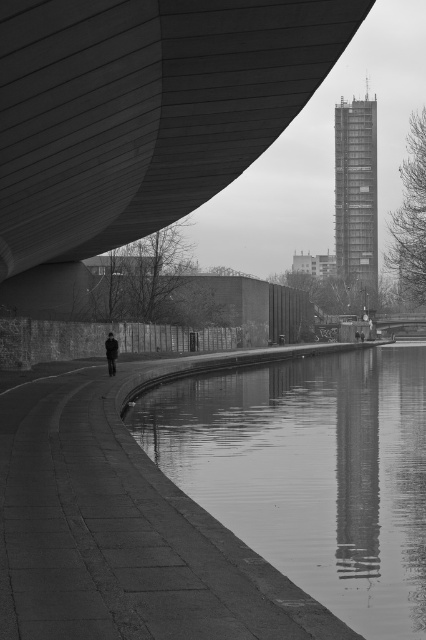
You are standing at the center of the image and want to locate the smooth concrete bridge at upper left. According to the coordinates provided, in which direction should you look to find it?

The smooth concrete bridge at upper left is located at coordinates point (143, 109), which is to the upper left direction from the center of the image.

You are a photographer standing on the smooth concrete bridge at upper left and want to take a photo of the dark gray fabric jacket at lower center. Considering the size difference between them, how might this affect your composition?

The smooth concrete bridge at upper left is larger in size than the dark gray fabric jacket at lower center, so to balance the composition, you could position the jacket centrally or use framing techniques to draw attention to it while incorporating the bridge as a backdrop.

You are standing at the curved concrete pathway in the foreground. Which direction should you walk to reach the smooth concrete bridge at upper left located at point (143, 109)?

The smooth concrete bridge at upper left is located at point (143, 109), so you should walk towards the upper left direction to reach it.